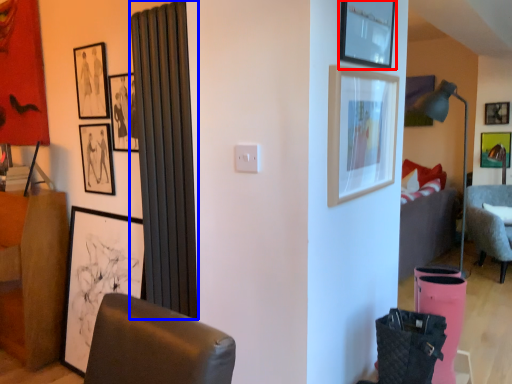
Question: Among these objects, which one is nearest to the camera, picture frame (highlighted by a red box) or curtain (highlighted by a blue box)?

Choices:
 (A) picture frame
 (B) curtain

Answer: (A)